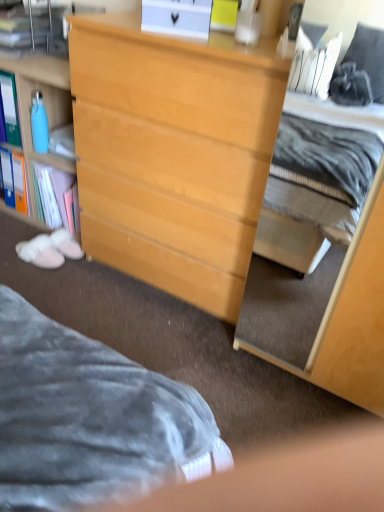
Question: Relative to light wood dresser at center, is light wood dresser at center, the second cabinetry from the left, in front or behind?

Choices:
 (A) behind
 (B) front

Answer: (B)

Question: From the image's perspective, is light wood dresser at center, the 1th cabinetry in the right-to-left sequence, positioned above or below light wood dresser at center?

Choices:
 (A) above
 (B) below

Answer: (B)

Question: Based on their relative distances, which object is farther from the light wood dresser at center?

Choices:
 (A) matte blue bottle at left
 (B) light wood dresser at center, the 1th cabinetry in the right-to-left sequence
 (C) light wood cabinet at center, which ranks as the first cabinetry in left-to-right order

Answer: (A)

Question: Based on their relative distances, which object is nearer to the light wood cabinet at center, which ranks as the first cabinetry in left-to-right order?

Choices:
 (A) light wood dresser at center
 (B) matte blue bottle at left
 (C) light wood dresser at center, the second cabinetry from the left

Answer: (B)